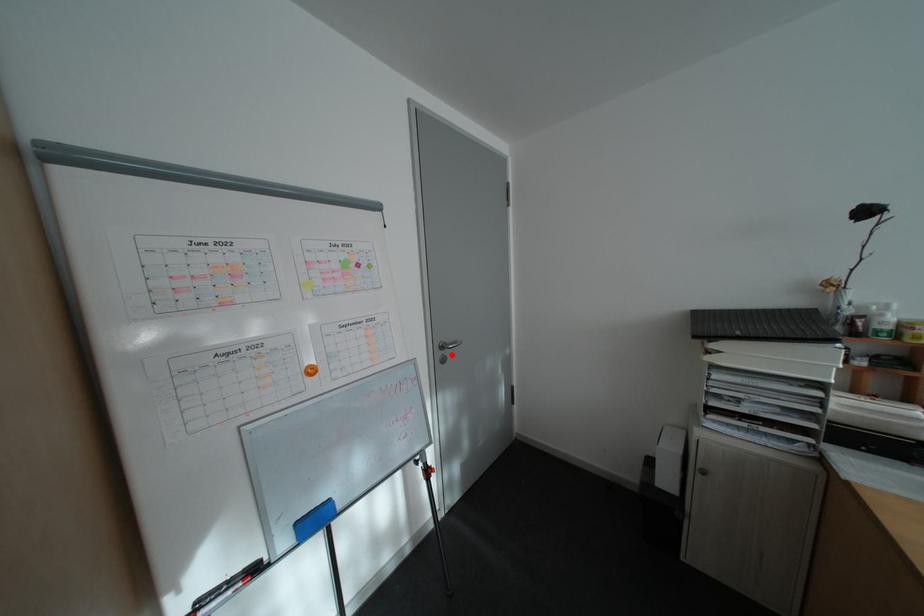
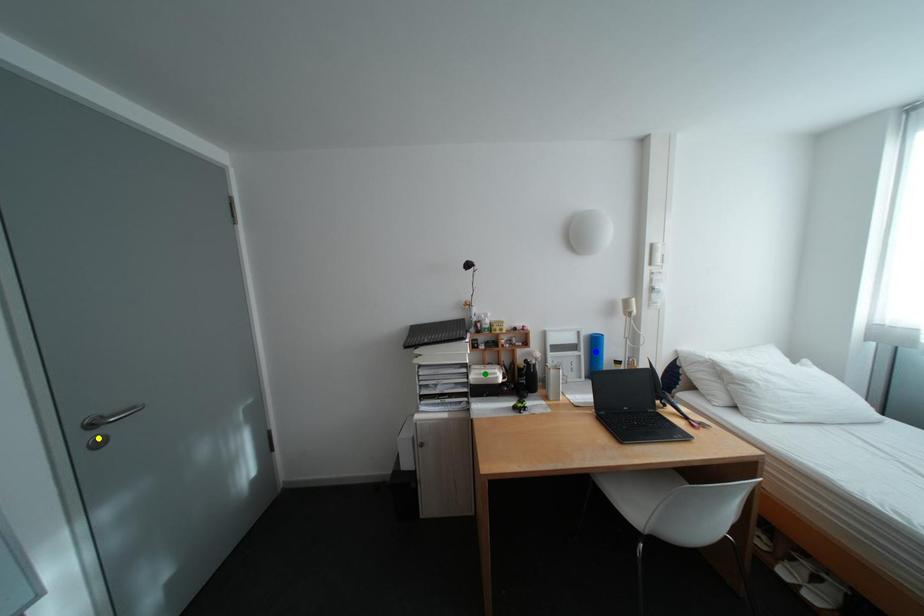
Question: I am providing you with two images of the same scene from different viewpoints. A red point is marked on the first image. You are given multiple points on the second image. Which point in image 2 is actually the same real-world point as the red point in image 1?

Choices:
 (A) blue point
 (B) green point
 (C) yellow point

Answer: (C)